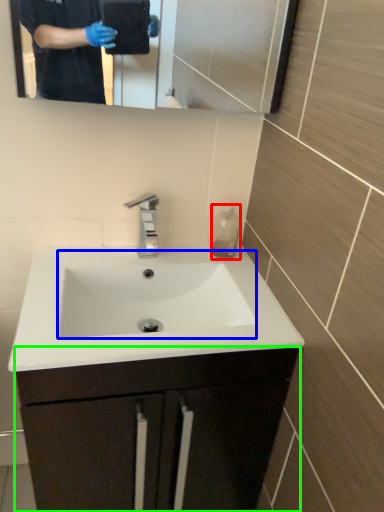
Question: Estimate the real-world distances between objects in this image. Which object is closer to liquid (highlighted by a red box), sink (highlighted by a blue box) or bathroom cabinet (highlighted by a green box)?

Choices:
 (A) sink
 (B) bathroom cabinet

Answer: (A)